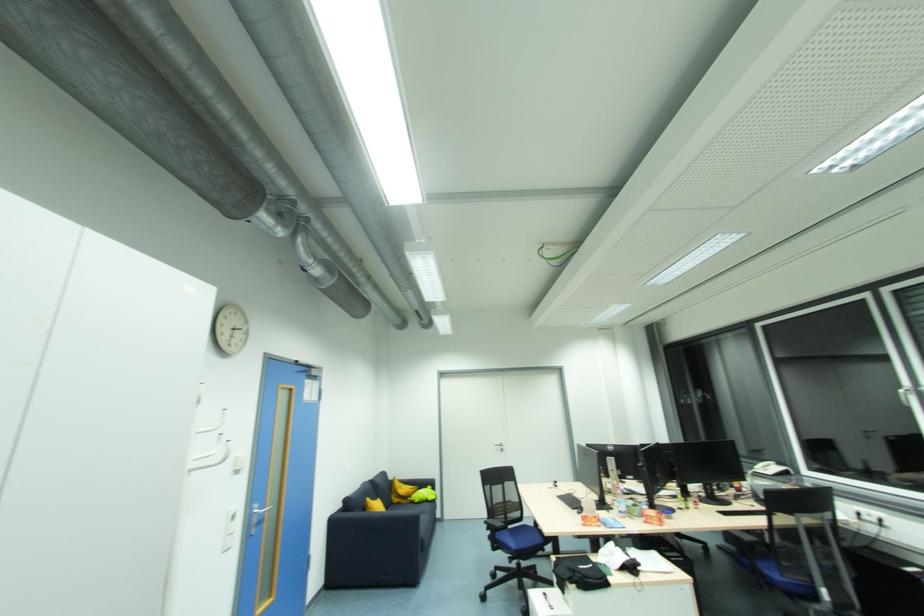
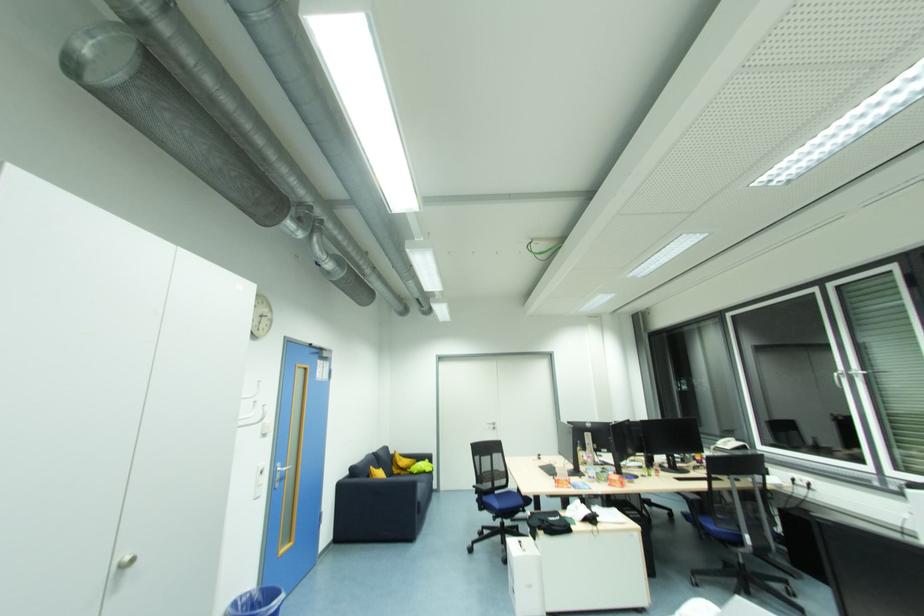
The point at (397, 501) is marked in the first image. Where is the corresponding point in the second image?

(398, 472)